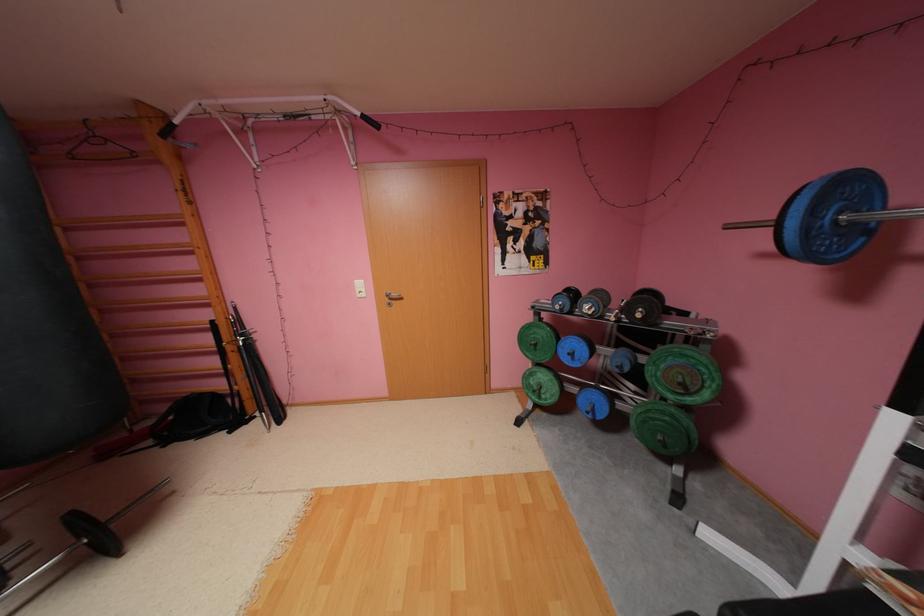
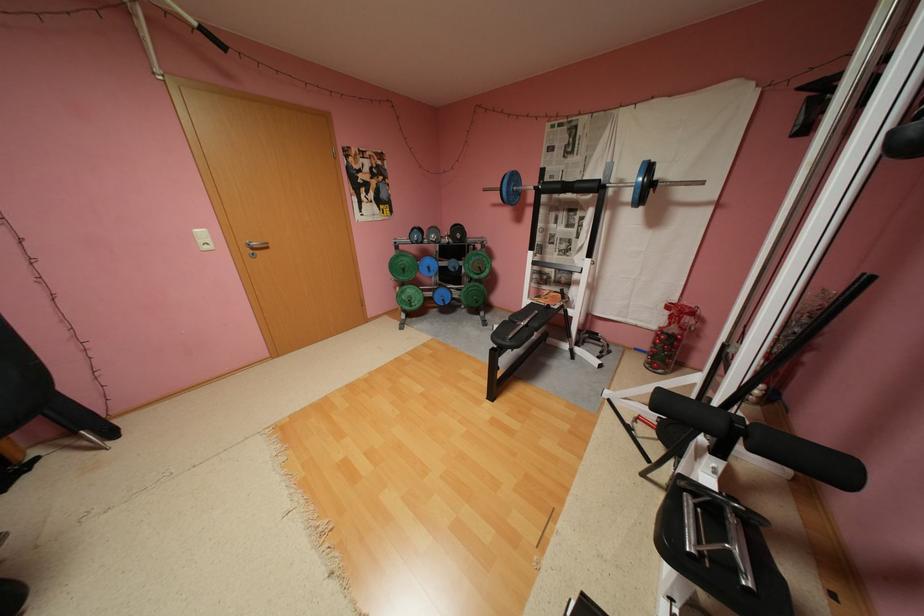
Find the pixel in the second image that matches (816,229) in the first image.

(517, 191)